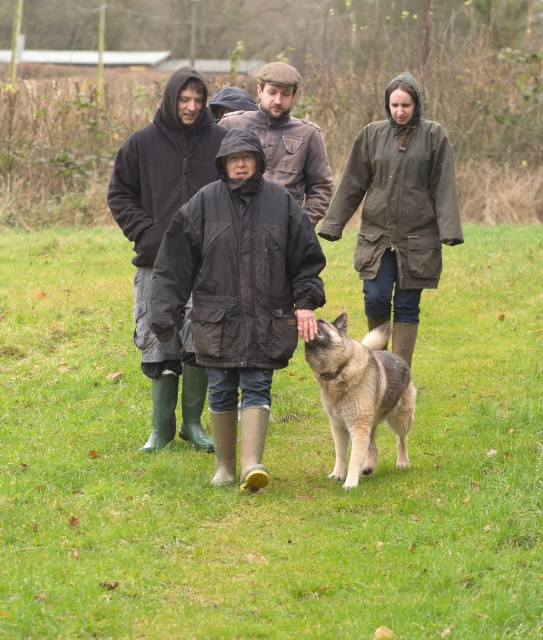
Is dark matte jacket at center wider than brown leather jacket at center?

In fact, dark matte jacket at center might be narrower than brown leather jacket at center.

Can you confirm if dark matte jacket at center is shorter than brown leather jacket at center?

Yes.

Does point (209, 131) come behind point (267, 74)?

No, it is in front of (267, 74).

Identify the location of dark matte jacket at center. The image size is (543, 640). (161, 240).

Does green grassy at center appear over gray-furred dog at center?

Indeed, green grassy at center is positioned over gray-furred dog at center.

Between point (500, 304) and point (356, 380), which one is positioned behind?

Point (500, 304)

Who is more distant from viewer, (x=529, y=269) or (x=356, y=465)?

The point (x=529, y=269) is more distant.

At what (x,y) coordinates should I click in order to perform the action: click on green grassy at center. Please return your answer as a coordinate pair (x, y). This screenshot has height=640, width=543. Looking at the image, I should click on (268, 470).

Is green grassy at center shorter than dark matte jacket at center?

Incorrect, green grassy at center's height does not fall short of dark matte jacket at center's.

Does green grassy at center lie behind dark matte jacket at center?

That is False.

This screenshot has width=543, height=640. What do you see at coordinates (268, 470) in the screenshot?
I see `green grassy at center` at bounding box center [268, 470].

Image resolution: width=543 pixels, height=640 pixels. Find the location of `green grassy at center`. green grassy at center is located at coordinates (268, 470).